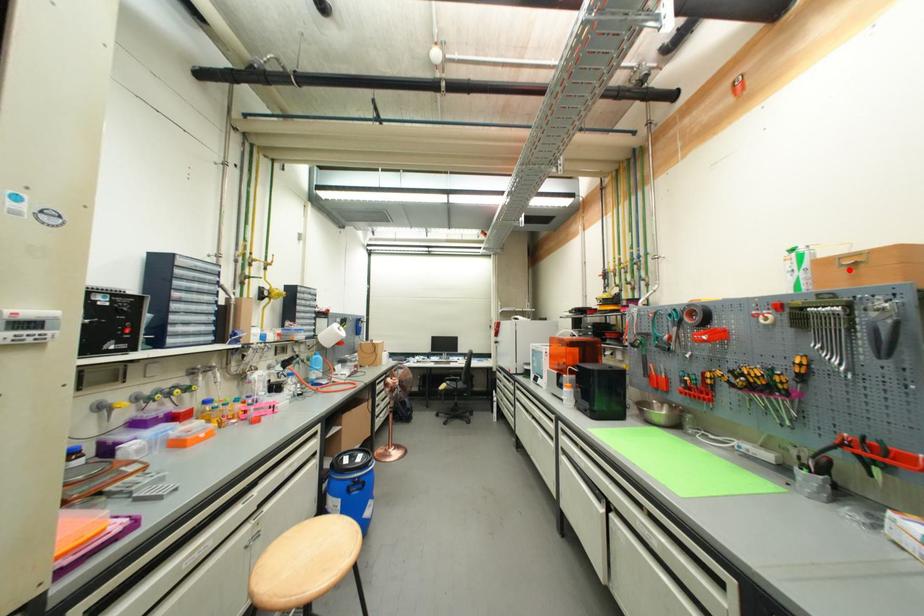
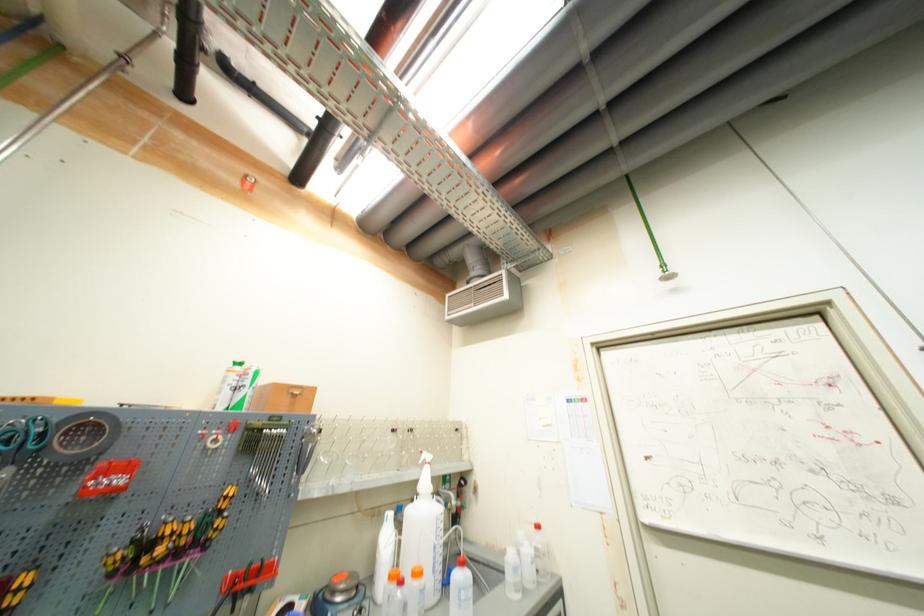
Find the pixel in the second image that matches the highlighted location in the first image.

(295, 398)